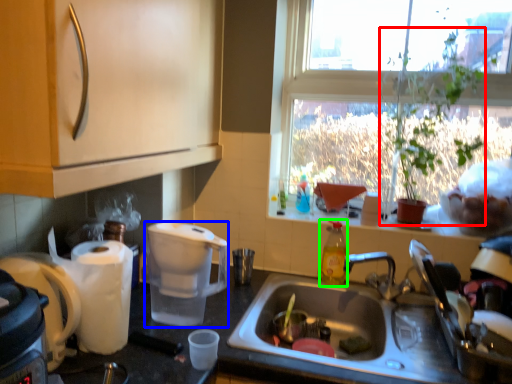
Question: Estimate the real-world distances between objects in this image. Which object is farther from houseplant (highlighted by a red box), coffee maker (highlighted by a blue box) or bottle (highlighted by a green box)?

Choices:
 (A) coffee maker
 (B) bottle

Answer: (A)